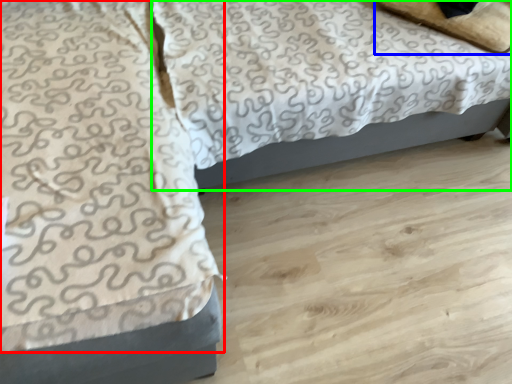
Question: Which object is the farthest from blanket (highlighted by a red box)? Choose among these: pillow (highlighted by a blue box) or bed (highlighted by a green box).

Choices:
 (A) pillow
 (B) bed

Answer: (A)